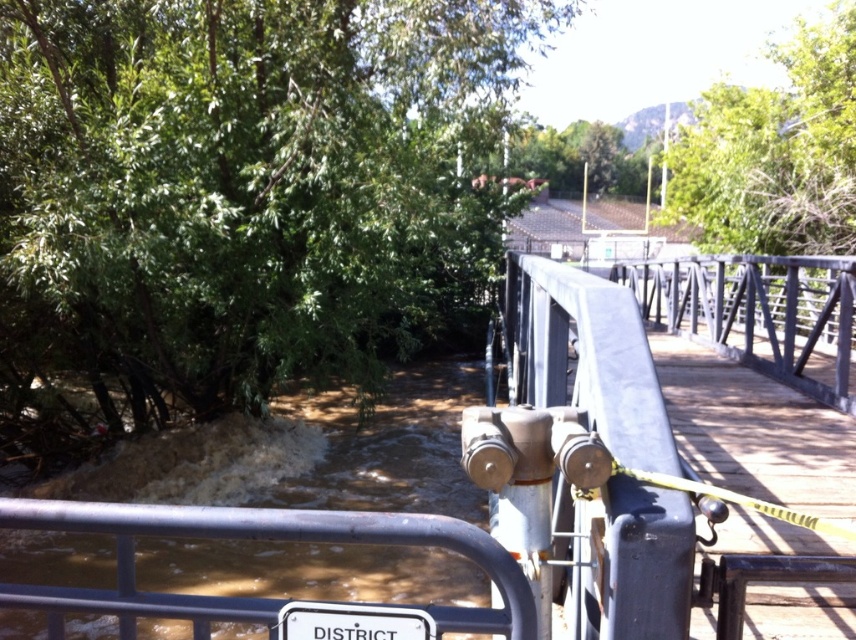
Question: Which of these objects is positioned closest to the metallic gray bridge at center?

Choices:
 (A) gray metallic rail at center
 (B) white plastic street sign at lower center
 (C) brushed metal railing at center

Answer: (B)

Question: Which object appears closest to the camera in this image?

Choices:
 (A) white plastic street sign at lower center
 (B) metallic gray bridge at center
 (C) gray metallic rail at center
 (D) brushed metal railing at center

Answer: (B)

Question: Does metallic gray bridge at center lie behind white plastic street sign at lower center?

Choices:
 (A) no
 (B) yes

Answer: (A)

Question: Which point appears farthest from the camera in this image?

Choices:
 (A) (129, 544)
 (B) (791, 323)
 (C) (364, 637)
 (D) (500, 445)

Answer: (B)

Question: Considering the relative positions of brushed metal railing at center and white plastic street sign at lower center in the image provided, where is brushed metal railing at center located with respect to white plastic street sign at lower center?

Choices:
 (A) above
 (B) below

Answer: (A)

Question: Can you confirm if metallic gray bridge at center is positioned below white plastic street sign at lower center?

Choices:
 (A) no
 (B) yes

Answer: (A)